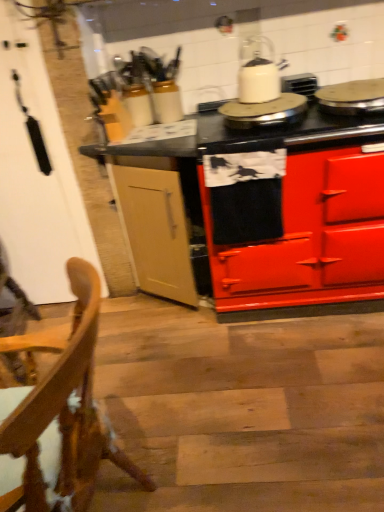
Question: Which direction should I rotate to look at white glossy kettle at upper center, acting as the 2th appliance starting from the right?

Choices:
 (A) right
 (B) left

Answer: (A)

Question: From a real-world perspective, is red glossy stove at center positioned under white glossy kettle at upper center, acting as the 2th appliance starting from the right, based on gravity?

Choices:
 (A) no
 (B) yes

Answer: (B)

Question: Could white glossy kettle at upper center, the first appliance positioned from the left, be considered to be inside red glossy stove at center?

Choices:
 (A) no
 (B) yes

Answer: (B)

Question: From the image's perspective, is red glossy stove at center on top of white glossy kettle at upper center, the first appliance positioned from the left?

Choices:
 (A) no
 (B) yes

Answer: (A)

Question: From a real-world perspective, is red glossy stove at center physically above white glossy kettle at upper center, the first appliance positioned from the left?

Choices:
 (A) yes
 (B) no

Answer: (B)

Question: Can you confirm if red glossy stove at center is taller than white glossy kettle at upper center, the first appliance positioned from the left?

Choices:
 (A) yes
 (B) no

Answer: (A)

Question: Is red glossy stove at center facing towards white glossy kettle at upper center, acting as the 2th appliance starting from the right?

Choices:
 (A) no
 (B) yes

Answer: (A)

Question: Is white glossy kettle at upper center outside white glossy kettle at upper center, acting as the 2th appliance starting from the right?

Choices:
 (A) yes
 (B) no

Answer: (A)

Question: Is the position of white glossy kettle at upper center more distant than that of white glossy kettle at upper center, acting as the 2th appliance starting from the right?

Choices:
 (A) yes
 (B) no

Answer: (A)

Question: Is white glossy kettle at upper center next to white glossy kettle at upper center, acting as the 2th appliance starting from the right, and touching it?

Choices:
 (A) yes
 (B) no

Answer: (A)

Question: Does white glossy kettle at upper center appear on the right side of white glossy kettle at upper center, acting as the 2th appliance starting from the right?

Choices:
 (A) no
 (B) yes

Answer: (A)

Question: Does white glossy kettle at upper center lie in front of white glossy kettle at upper center, the first appliance positioned from the left?

Choices:
 (A) no
 (B) yes

Answer: (A)

Question: Is white glossy kettle at upper center smaller than white glossy kettle at upper center, acting as the 2th appliance starting from the right?

Choices:
 (A) yes
 (B) no

Answer: (A)

Question: Does metallic silver pan at upper right, which ranks as the first appliance in right-to-left order, appear on the right side of wooden chair at lower left?

Choices:
 (A) yes
 (B) no

Answer: (A)